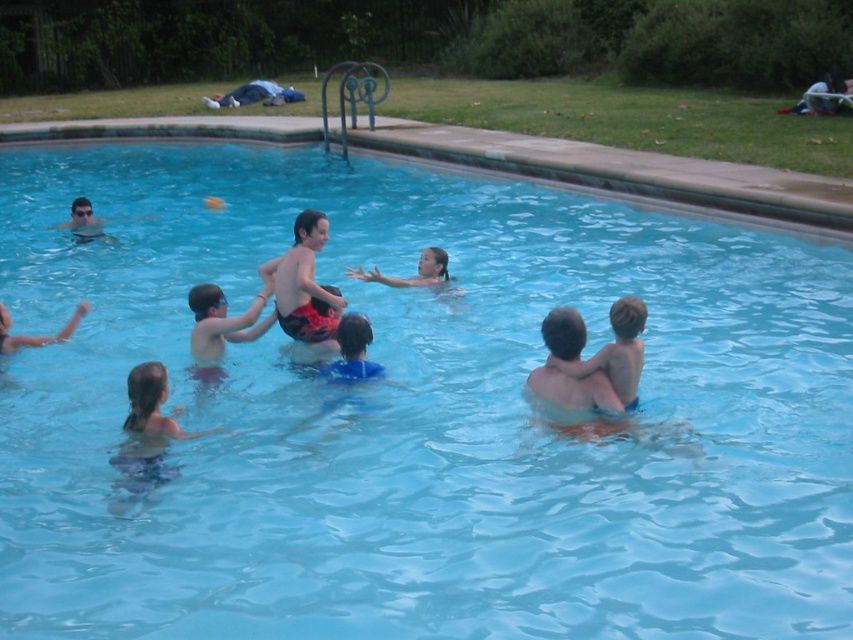
Measure the distance between blue fabric shirt at center and smooth skin girl at center.

blue fabric shirt at center and smooth skin girl at center are 5.38 feet apart from each other.

Does blue fabric shirt at center have a smaller size compared to smooth skin girl at center?

Correct, blue fabric shirt at center occupies less space than smooth skin girl at center.

This screenshot has width=853, height=640. In order to click on blue fabric shirt at center in this screenshot , I will do `click(352, 349)`.

This screenshot has width=853, height=640. I want to click on blue fabric shirt at center, so click(352, 349).

Does point (584, 376) come farther from viewer compared to point (82, 236)?

No, (584, 376) is closer to viewer.

Which is below, smooth skin child at center or matte gray swimmer at upper left?

smooth skin child at center is below.

This screenshot has height=640, width=853. What do you see at coordinates (616, 353) in the screenshot?
I see `smooth skin child at center` at bounding box center [616, 353].

Locate an element on the screen. The width and height of the screenshot is (853, 640). smooth skin child at center is located at coordinates (616, 353).

How far apart are blue fabric shirt at center and matte gray swimmer at upper left?

blue fabric shirt at center is 8.04 meters away from matte gray swimmer at upper left.

Which is above, blue fabric shirt at center or matte gray swimmer at upper left?

matte gray swimmer at upper left is above.

What do you see at coordinates (352, 349) in the screenshot?
I see `blue fabric shirt at center` at bounding box center [352, 349].

I want to click on blue fabric shirt at center, so click(352, 349).